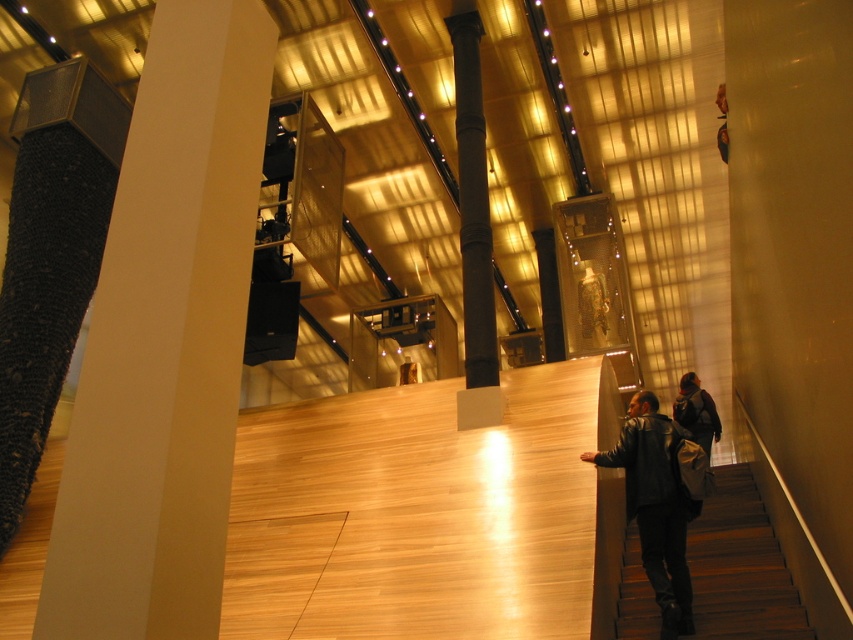
Where is `white matte column at left`? white matte column at left is located at coordinates (165, 340).

Can you confirm if white matte column at left is positioned to the right of black polished column at center?

No, white matte column at left is not to the right of black polished column at center.

Find the location of `white matte column at left`. white matte column at left is located at coordinates click(165, 340).

Where is `white matte column at left`? Image resolution: width=853 pixels, height=640 pixels. white matte column at left is located at coordinates (165, 340).

In the scene shown: Is the position of white matte column at left more distant than that of dark leather jacket at lower right?

That is False.

This screenshot has width=853, height=640. What do you see at coordinates (165, 340) in the screenshot?
I see `white matte column at left` at bounding box center [165, 340].

Does point (144, 132) come closer to viewer compared to point (666, 486)?

Yes, point (144, 132) is in front of point (666, 486).

Where is `white matte column at left`? The image size is (853, 640). white matte column at left is located at coordinates (165, 340).

Is point (474, 198) farther from camera compared to point (708, 433)?

No, it is not.

Locate an element on the screen. This screenshot has height=640, width=853. black polished column at center is located at coordinates (473, 198).